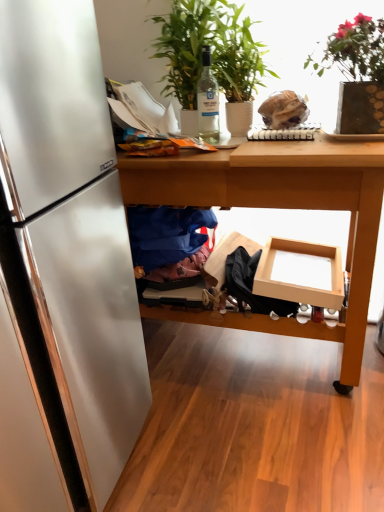
I want to click on free spot in front of wooden table at center, so click(251, 449).